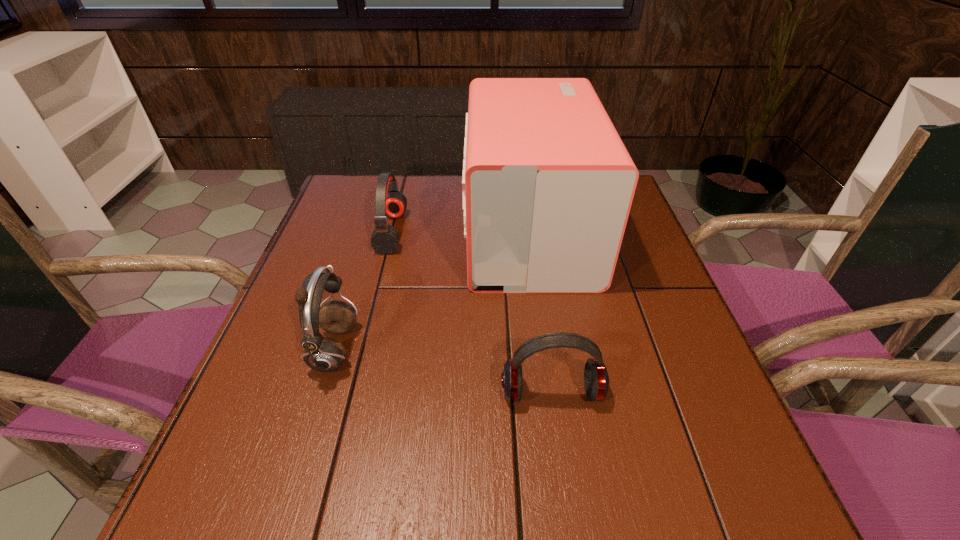
You are a GUI agent. You are given a task and a screenshot of the screen. Output one action in this format:
    pyautogui.click(x=<x>, y=<y>)
    Task: Click on the vacant region between the rightmost earphone and the farthest earphone
    
    Given the screenshot: What is the action you would take?
    pyautogui.click(x=472, y=313)

Identify the location of object that stands as the closest to the rightmost earphone. (548, 184).

Where is `object that is the closest to the rightmost earphone`? object that is the closest to the rightmost earphone is located at coordinates (548, 184).

Locate an element on the screen. Image resolution: width=960 pixels, height=540 pixels. earphone that is the closest to the rightmost earphone is located at coordinates tap(324, 354).

Locate which earphone ranks second in proximity to the box. Please provide its 2D coordinates. Your answer should be formatted as a tuple, i.e. [(x, y)], where the tuple contains the x and y coordinates of a point satisfying the conditions above.

[(596, 380)]